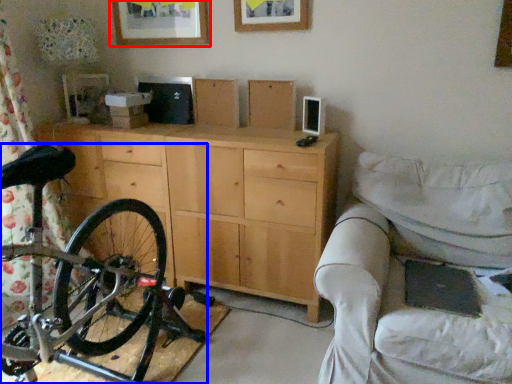
Question: Among these objects, which one is farthest to the camera, picture frame (highlighted by a red box) or bicycle (highlighted by a blue box)?

Choices:
 (A) picture frame
 (B) bicycle

Answer: (A)